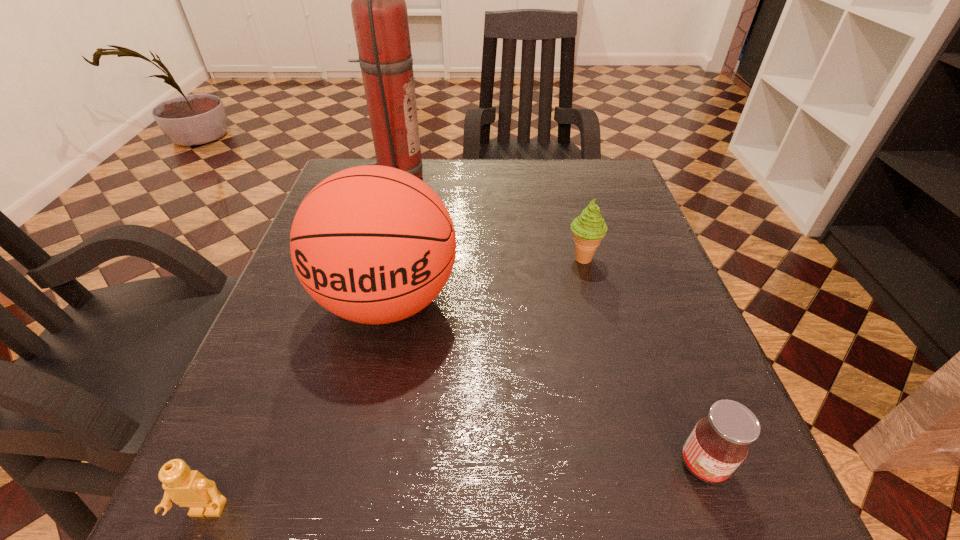
Identify the location of vacant area between the third shortest object and the farthest object. This screenshot has height=540, width=960. (490, 218).

You are a GUI agent. You are given a task and a screenshot of the screen. Output one action in this format:
    pyautogui.click(x=<x>, y=<y>)
    Task: Click on the free point between the jam and the third tallest object
    The height and width of the screenshot is (540, 960).
    Given the screenshot: What is the action you would take?
    [x=642, y=361]

In order to click on free space between the third tallest object and the second nearest object in this screenshot , I will do `click(642, 361)`.

Find the location of `free space between the basketball and the nearest object`. free space between the basketball and the nearest object is located at coordinates (298, 406).

You are a GUI agent. You are given a task and a screenshot of the screen. Output one action in this format:
    pyautogui.click(x=<x>, y=<y>)
    Task: Click on the vacant space that is in between the rightmost object and the Lego
    The height and width of the screenshot is (540, 960).
    Given the screenshot: What is the action you would take?
    pyautogui.click(x=455, y=488)

You are a GUI agent. You are given a task and a screenshot of the screen. Output one action in this format:
    pyautogui.click(x=<x>, y=<y>)
    Task: Click on the free point between the farthest object and the Lego
    Image resolution: width=960 pixels, height=540 pixels.
    Given the screenshot: What is the action you would take?
    pyautogui.click(x=302, y=345)

I want to click on object that is the fourth nearest to the nearest object, so click(379, 12).

Point out which object is positioned as the fourth nearest to the icecream. Please provide its 2D coordinates. Your answer should be formatted as a tuple, i.e. [(x, y)], where the tuple contains the x and y coordinates of a point satisfying the conditions above.

[(189, 488)]

I want to click on free location that satisfies the following two spatial constraints: 1. on the side of the farthest object with the label and nozzle; 2. on the face of the nearest object, so click(308, 511).